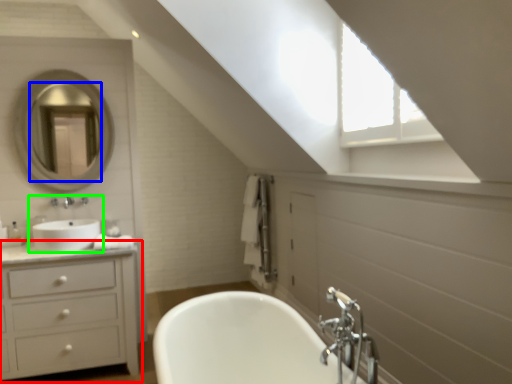
Question: Estimate the real-world distances between objects in this image. Which object is farther from bathroom cabinet (highlighted by a red box), mirror (highlighted by a blue box) or sink (highlighted by a green box)?

Choices:
 (A) mirror
 (B) sink

Answer: (A)